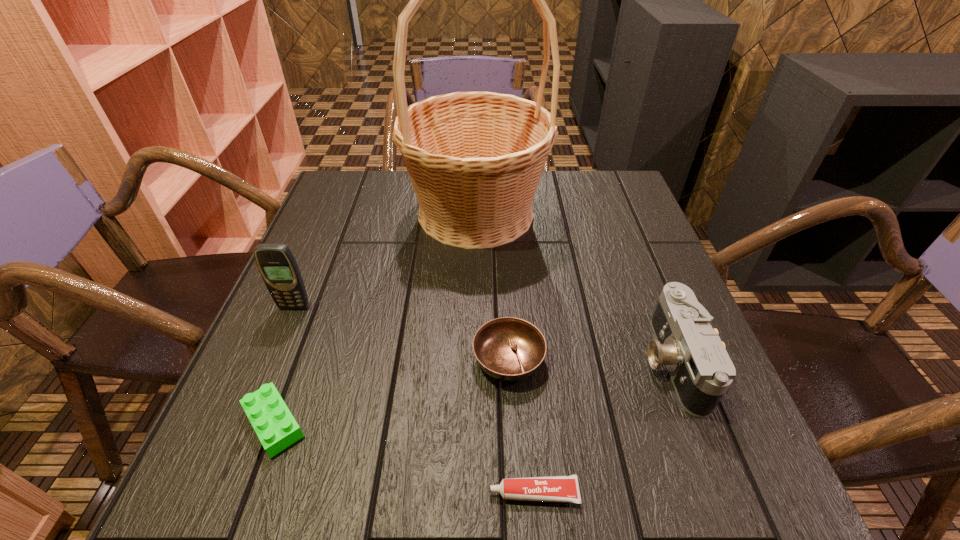
Locate an element on the screen. The width and height of the screenshot is (960, 540). vacant space located 0.110m on the right of the tallest object is located at coordinates (588, 213).

Find the location of a particular element. vacant region located 0.100m on the screen of the cellular telephone is located at coordinates (277, 348).

Where is `vacant space situated on the lens of the rightmost object`? vacant space situated on the lens of the rightmost object is located at coordinates point(491,361).

Locate an element on the screen. vacant area situated on the lens of the rightmost object is located at coordinates (534, 361).

Locate an element on the screen. This screenshot has height=540, width=960. free location located on the lens of the rightmost object is located at coordinates (591, 361).

In order to click on vacant space situated 0.400m on the back of the soup bowl in this screenshot , I will do `click(500, 217)`.

What are the coordinates of `free point located 0.060m on the front of the Lego` in the screenshot? It's located at (246, 498).

In order to click on vacant space located at the nozzle of the nearest object in this screenshot , I will do `click(301, 492)`.

Identify the location of vacant space located 0.080m at the nozzle of the nearest object. pyautogui.click(x=436, y=492).

Locate an element on the screen. This screenshot has width=960, height=540. blank space located at the nozzle of the nearest object is located at coordinates (315, 492).